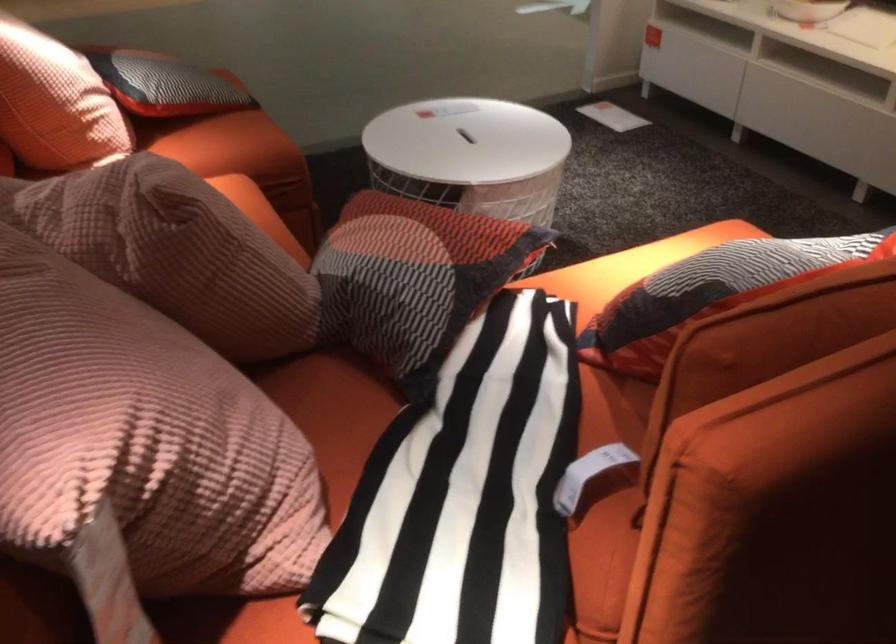
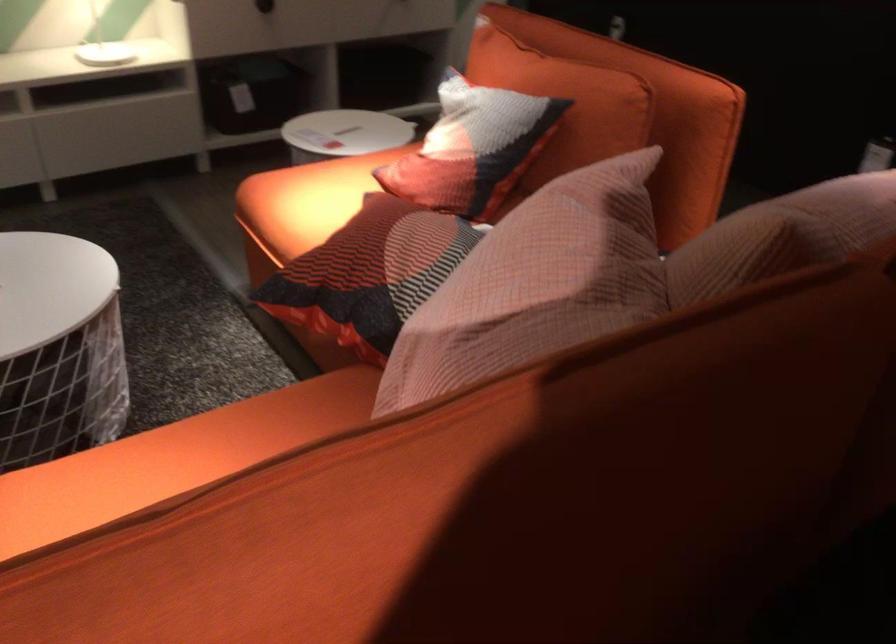
Where in the second image is the point corresponding to [346,214] from the first image?

(369, 274)